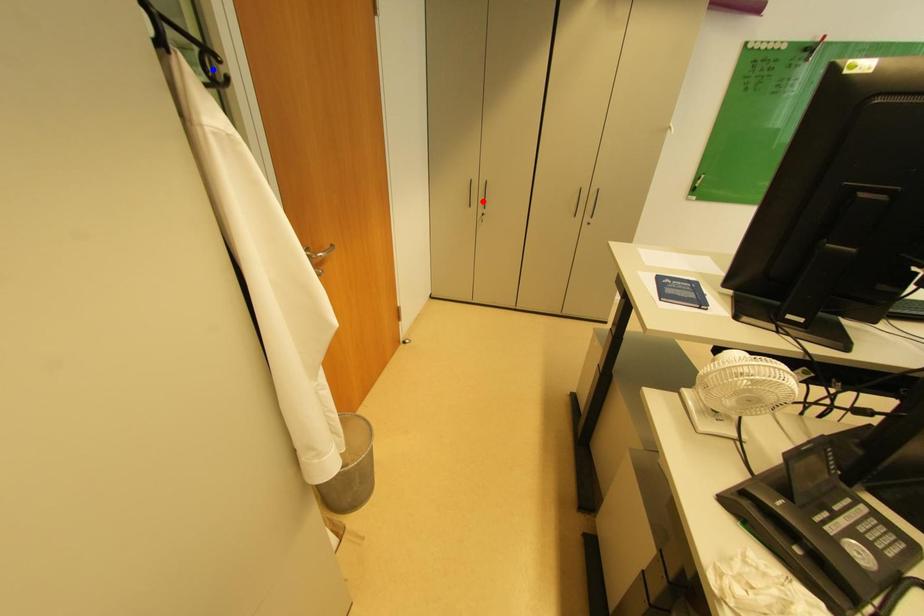
Question: Two points are marked on the image. Which point is closer to the camera?

Choices:
 (A) Blue point is closer.
 (B) Red point is closer.

Answer: (A)